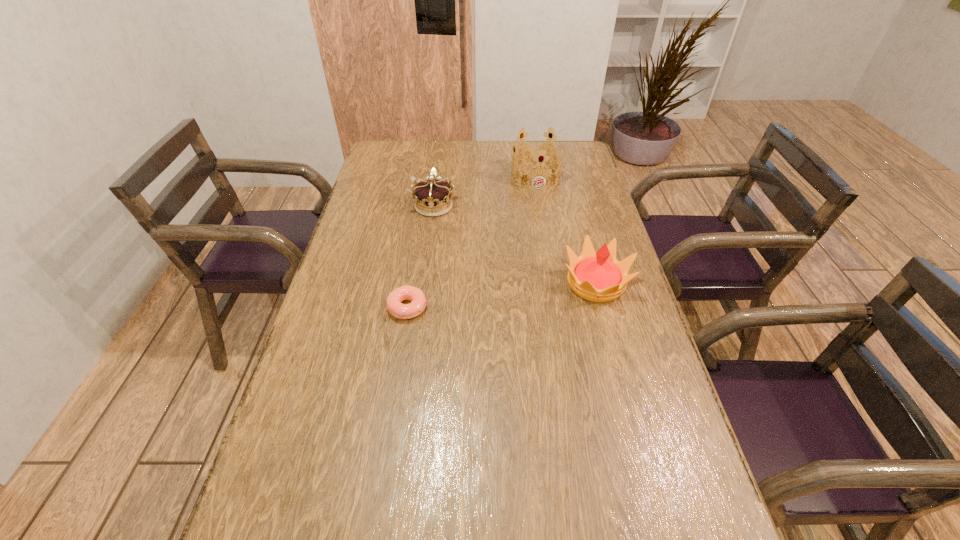
Image resolution: width=960 pixels, height=540 pixels. What are the coordinates of `unoccupied position between the nearest crown and the shortest object` in the screenshot? It's located at (502, 295).

The image size is (960, 540). Find the location of `vacant space that's between the shortest object and the nearest crown`. vacant space that's between the shortest object and the nearest crown is located at coordinates (502, 295).

Where is `vacant point located between the second nearest crown and the farthest object`? The image size is (960, 540). vacant point located between the second nearest crown and the farthest object is located at coordinates pos(485,191).

Locate an element on the screen. free space between the nearest crown and the shortest object is located at coordinates (502, 295).

This screenshot has width=960, height=540. I want to click on free space between the second shortest object and the nearest crown, so click(515, 245).

Where is `blank region between the third tallest object and the farthest crown`? This screenshot has height=540, width=960. blank region between the third tallest object and the farthest crown is located at coordinates (485, 191).

Image resolution: width=960 pixels, height=540 pixels. Find the location of `object identified as the third closest to the third tallest object`. object identified as the third closest to the third tallest object is located at coordinates (597, 276).

Choose which object is the third nearest neighbor to the second farthest object. Please provide its 2D coordinates. Your answer should be formatted as a tuple, i.e. [(x, y)], where the tuple contains the x and y coordinates of a point satisfying the conditions above.

[(597, 276)]

Select which crown appears as the second closest to the doughnut. Please provide its 2D coordinates. Your answer should be formatted as a tuple, i.e. [(x, y)], where the tuple contains the x and y coordinates of a point satisfying the conditions above.

[(597, 276)]

Identify which crown is the third closest to the doughnut. Please provide its 2D coordinates. Your answer should be formatted as a tuple, i.e. [(x, y)], where the tuple contains the x and y coordinates of a point satisfying the conditions above.

[(537, 151)]